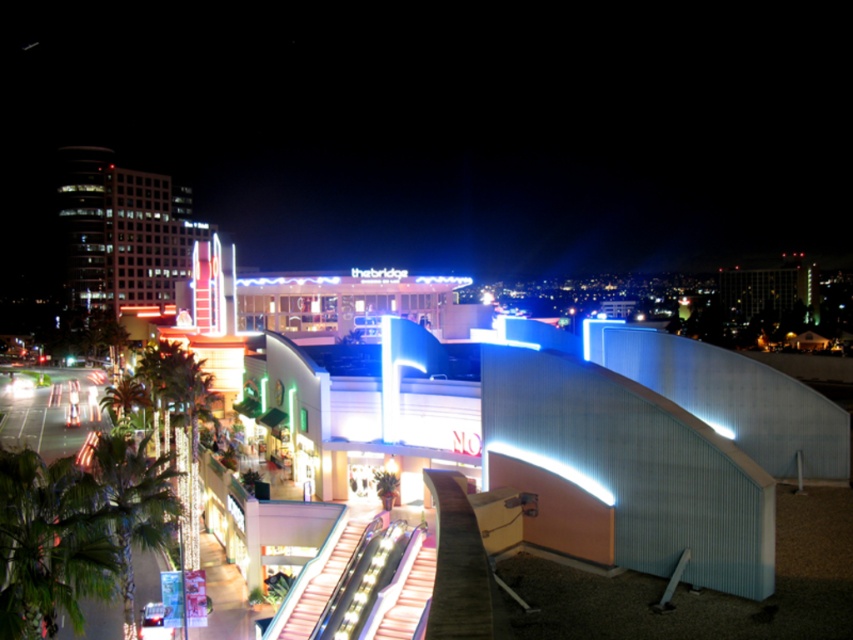
Can you confirm if glassy white building at upper left is positioned to the right of metallic silver escalator at center?

In fact, glassy white building at upper left is to the left of metallic silver escalator at center.

Is glassy white building at upper left to the left of metallic silver escalator at center from the viewer's perspective?

Yes, glassy white building at upper left is to the left of metallic silver escalator at center.

Is point (80, 292) in front of point (303, 636)?

That is False.

This screenshot has width=853, height=640. I want to click on glassy white building at upper left, so click(120, 230).